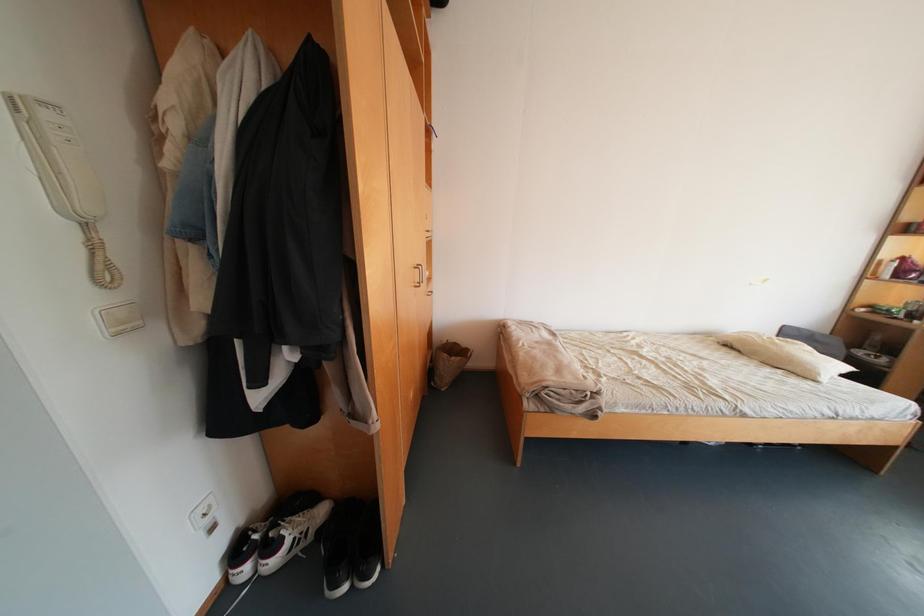
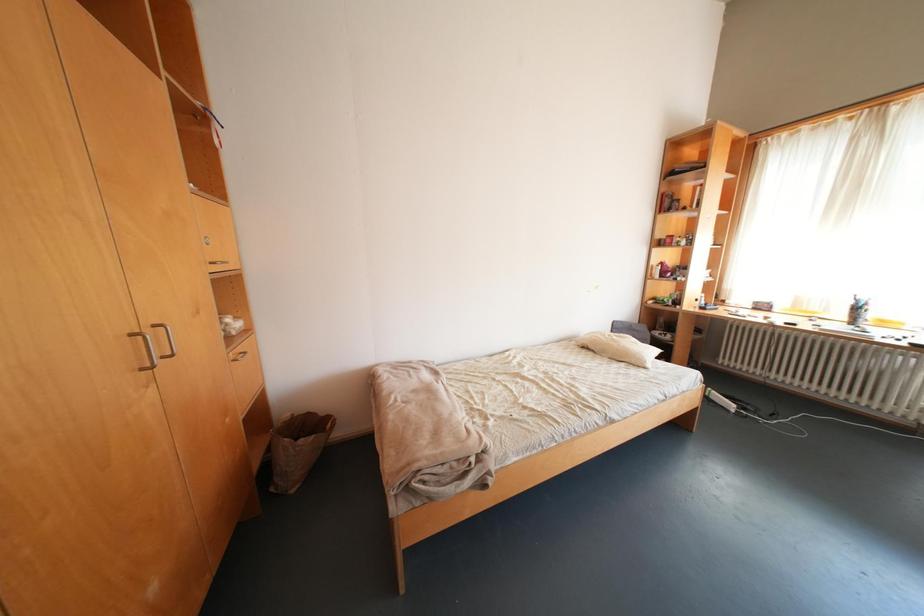
Question: The camera is either moving clockwise (left) or counter-clockwise (right) around the object. The first image is from the beginning of the video and the second image is from the end. Is the camera moving left or right when shooting the video?

Choices:
 (A) Left
 (B) Right

Answer: (A)